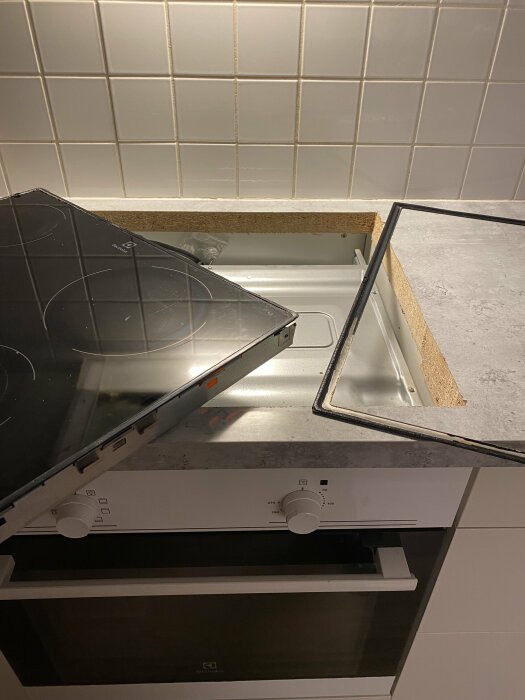
Locate an element on the screen. stove top frame is located at coordinates (466, 554), (466, 696), (492, 448).